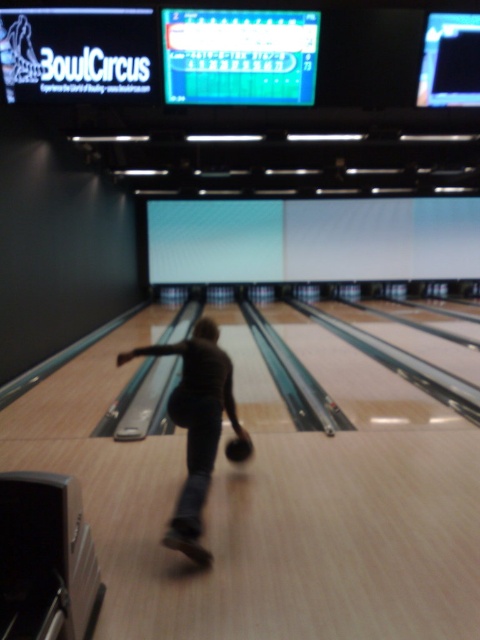
You are a bowling coach observing a bowler holding two balls during practice. The dark brown leather bowling ball at center and the black matte bowling ball at center. Which one is positioned to the left?

Answer: The dark brown leather bowling ball at center is positioned to the left of the black matte bowling ball at center.

You are standing at the point labeled point (193, 557) and want to roll a ball to the point labeled point (245, 438). Which direction should you roll the ball to reach the target?

You should roll the ball towards the point labeled point (245, 438). Since point (193, 557) is closer to the camera than point (245, 438), you need to roll the ball away from yourself towards the background to reach the target.